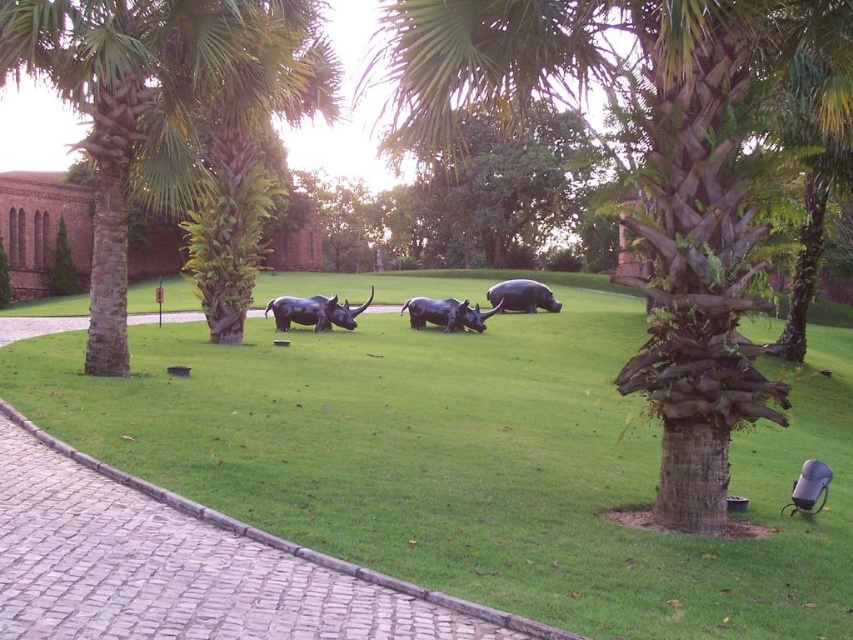
You are a visitor at a park and want to take a photo of the polished black rhino at center with the black plastic chair at lower right in the background. Can the chair be seen in the background if you focus on the rhino?

The polished black rhino at center is much taller than the black plastic chair at lower right, so the chair might be partially or fully obscured if the rhino is in the foreground. Adjust your position to ensure the chair is visible in the background.

You are a gardener who needs to water the green grass at center and the shiny black buffalo at center. Your watering can has a range of 10 meters. Can you water both areas without moving your position?

The distance between the green grass at center and the shiny black buffalo at center is 10.42 meters. Since your watering can only reaches 10 meters, you cannot water both areas without moving your position because the distance exceeds the watering can range.